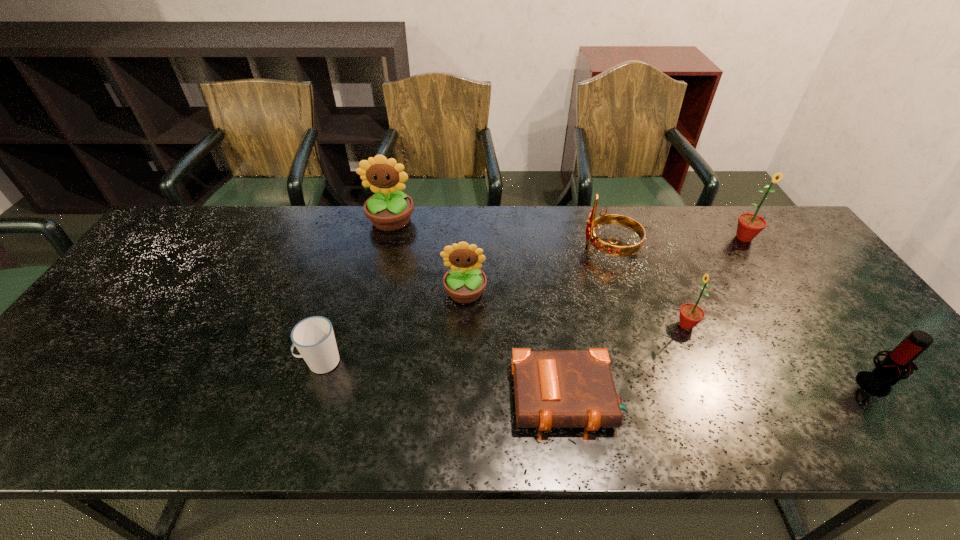
This screenshot has width=960, height=540. Identify the location of vacant region located on the face of the nearer green sunflower. (546, 325).

Locate an element on the screen. This screenshot has width=960, height=540. vacant space located on the face of the nearer green sunflower is located at coordinates (620, 325).

Where is `vacant space located on the back of the red microphone`? vacant space located on the back of the red microphone is located at coordinates (802, 284).

Identify the location of free location located 0.060m with a handle on the side of the second shortest object. The height and width of the screenshot is (540, 960). (274, 362).

Identify the location of vacant space positioned with a handle on the side of the second shortest object. This screenshot has height=540, width=960. (165, 362).

You are a GUI agent. You are given a task and a screenshot of the screen. Output one action in this format:
    pyautogui.click(x=<x>, y=<y>)
    Task: Click on the vacant space located 0.120m with a handle on the side of the second shortest object
    This screenshot has height=540, width=960.
    Given the screenshot: What is the action you would take?
    pyautogui.click(x=249, y=362)

This screenshot has width=960, height=540. I want to click on tiara that is at the far edge, so click(x=610, y=248).

Where is `object located in the near edge section of the desktop`? object located in the near edge section of the desktop is located at coordinates (553, 388).

At what (x,y) coordinates should I click in order to perform the action: click on sunflower located in the right edge section of the desktop. Please return your answer as a coordinate pair (x, y). Looking at the image, I should click on (749, 225).

Image resolution: width=960 pixels, height=540 pixels. Identify the location of microphone situated at the right edge. (890, 370).